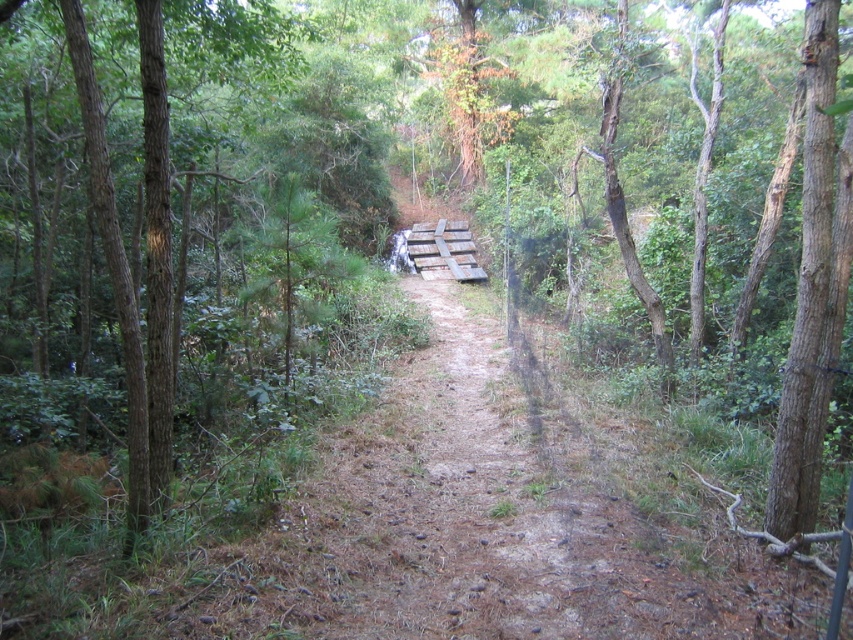
Question: Is brown textured tree at left further to the viewer compared to brown rough bark tree at right?

Choices:
 (A) no
 (B) yes

Answer: (B)

Question: Is brown textured tree at left thinner than brown rough bark tree at right?

Choices:
 (A) no
 (B) yes

Answer: (B)

Question: Which point is closer to the camera?

Choices:
 (A) (67, 433)
 (B) (817, 376)

Answer: (B)

Question: Among these objects, which one is farthest from the camera?

Choices:
 (A) brown textured tree at left
 (B) brown rough bark tree at right

Answer: (A)

Question: Does brown textured tree at left lie behind brown rough bark tree at right?

Choices:
 (A) no
 (B) yes

Answer: (B)

Question: Which object appears farthest from the camera in this image?

Choices:
 (A) brown textured tree at left
 (B) brown rough bark tree at right

Answer: (A)